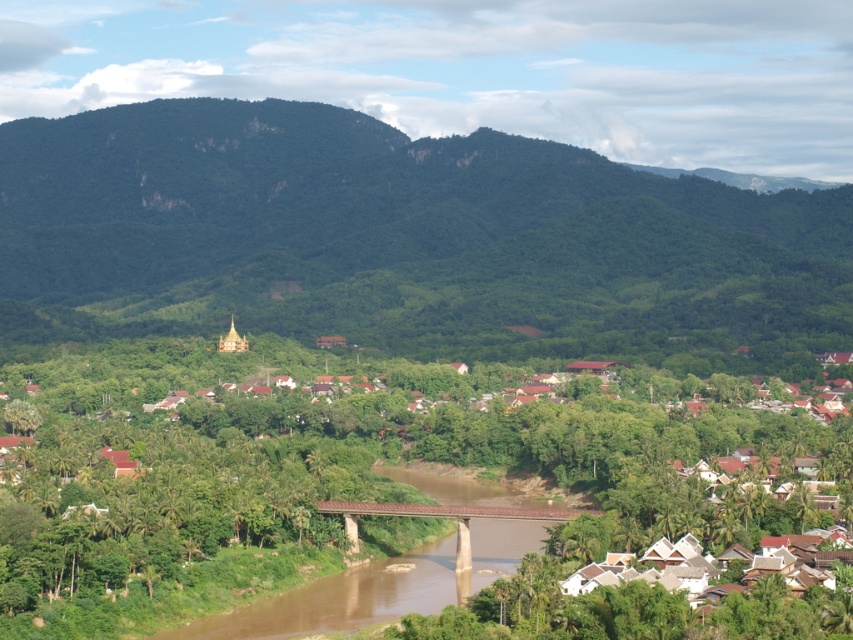
Can you confirm if green leafy forest at upper center is positioned above brown concrete bridge at center?

Indeed, green leafy forest at upper center is positioned over brown concrete bridge at center.

Does point (33, 230) lie in front of point (381, 508)?

That is False.

The image size is (853, 640). Identify the location of green leafy forest at upper center. (403, 241).

Does green leafy forest at upper center appear under white matte houses at center?

Incorrect, green leafy forest at upper center is not positioned below white matte houses at center.

Image resolution: width=853 pixels, height=640 pixels. In order to click on green leafy forest at upper center in this screenshot , I will do `click(403, 241)`.

The height and width of the screenshot is (640, 853). I want to click on green leafy forest at upper center, so click(403, 241).

Is white matte houses at center shorter than brown concrete bridge at center?

Incorrect, white matte houses at center's height does not fall short of brown concrete bridge at center's.

Is white matte houses at center below brown concrete bridge at center?

No.

Image resolution: width=853 pixels, height=640 pixels. What do you see at coordinates (357, 484) in the screenshot?
I see `white matte houses at center` at bounding box center [357, 484].

This screenshot has height=640, width=853. What are the coordinates of `white matte houses at center` in the screenshot? It's located at tap(357, 484).